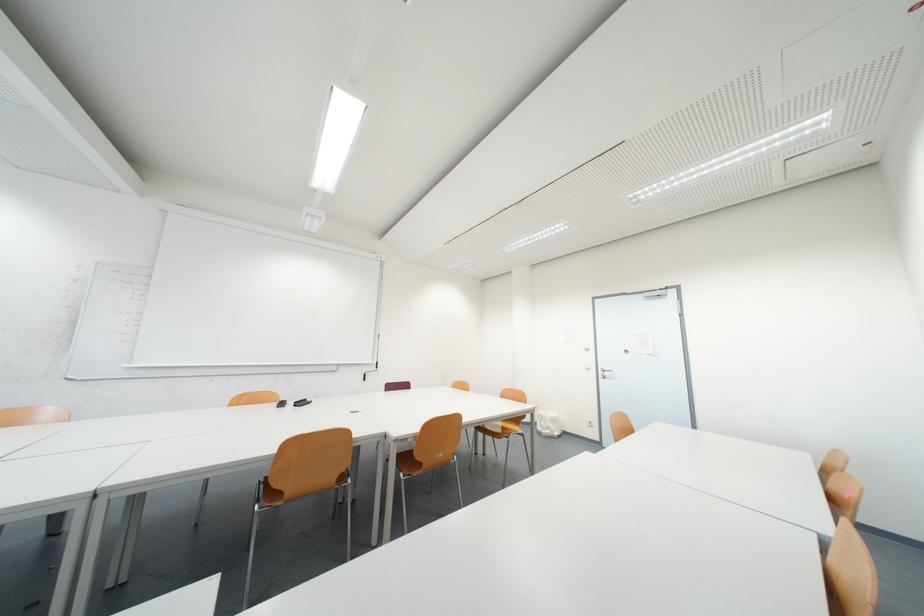
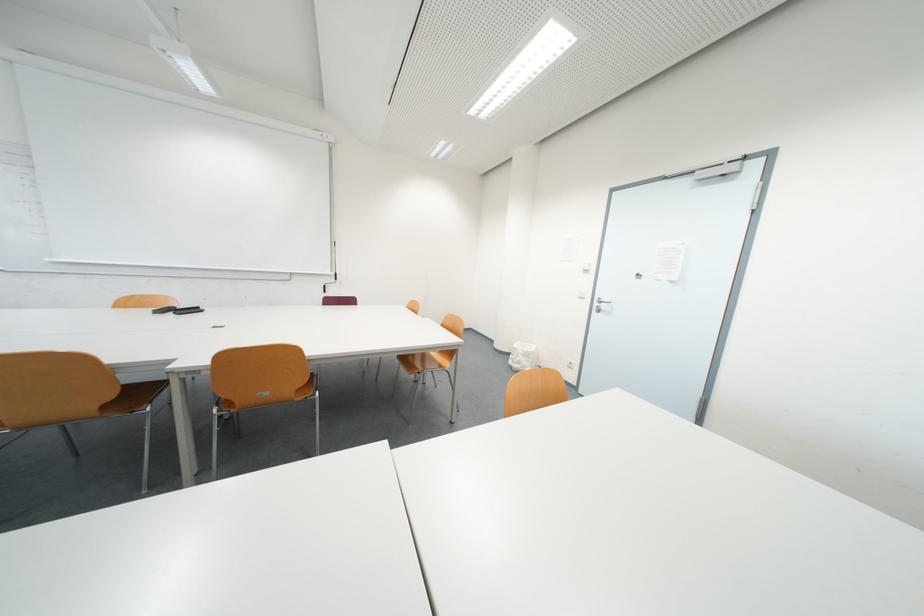
Find the pixel in the second image that matches the point at 354,468 in the first image.

(120, 397)